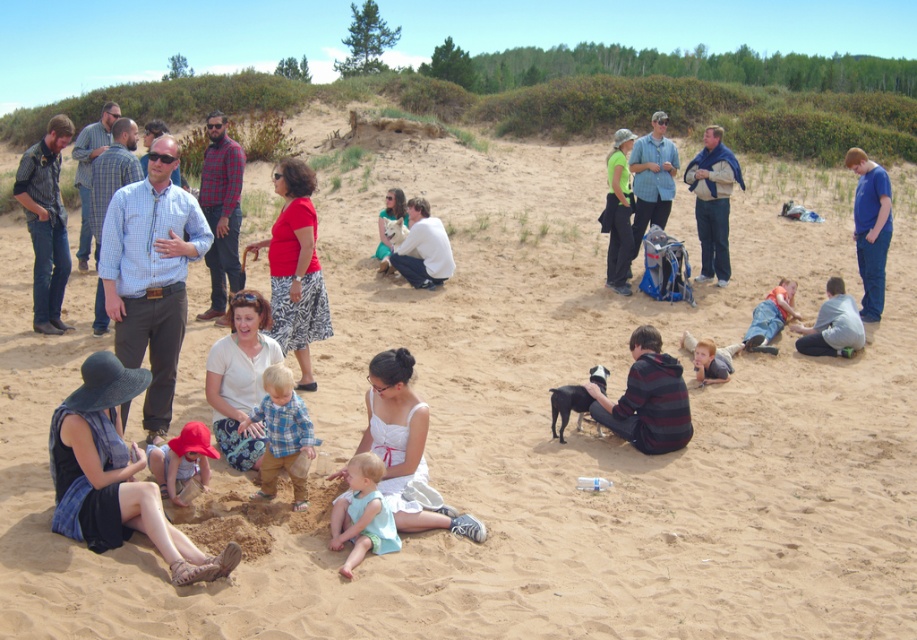
You are a beachgoer who wants to lay out your towel. You have two options in the image, the light blue fabric at center and the blue cotton shirt at right. Which one has enough space to comfortably lie down on?

The blue cotton shirt at right occupies more space than the light blue fabric at center, so it would be more suitable for lying down comfortably.

What is the 2D coordinate of the denim shirt at left in the beach scene?

The denim shirt at left is located at the 2D coordinate point of [46,221].

You are a photographer standing at the center of the beach scene. You want to position a new subject exactly where the light blue fabric at center is located. What are the coordinates of the spot where you should place the subject?

The coordinates for the light blue fabric at center are at point [362,513]. So you should place the subject at those coordinates.